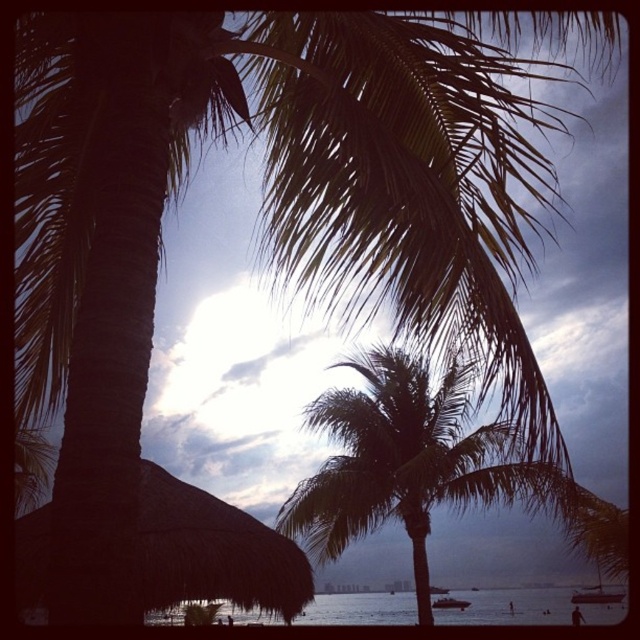
You are standing on the beach and want to take a photo of the dark green leafy palm tree at center and the transparent water at lower center. Which object will appear taller in the photo?

The dark green leafy palm tree at center will appear taller in the photo because it has a greater height compared to the transparent water at lower center.

You are a photographer trying to capture the perfect shot of the dark green leafy palm tree at center. You want to position your camera at a specific coordinate to ensure the tree is centered in your frame. What coordinate should you aim for?

The dark green leafy palm tree at center is located at coordinate point (x=406, y=461), so you should position your camera at that coordinate to center the tree in your frame.